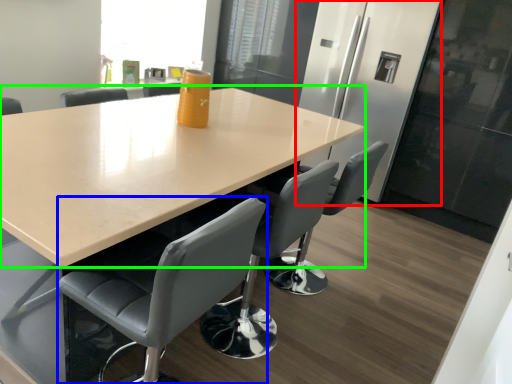
Question: Which object is the farthest from fridge (highlighted by a red box)? Choose among these: chair (highlighted by a blue box) or table (highlighted by a green box).

Choices:
 (A) chair
 (B) table

Answer: (A)